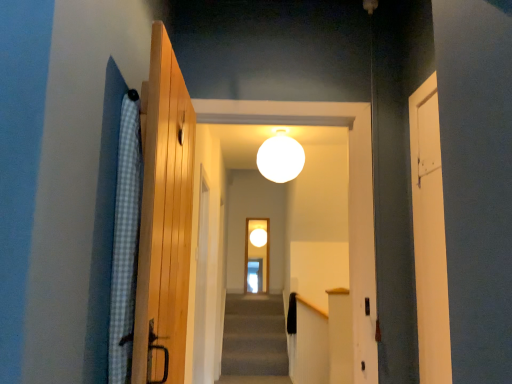
Question: Is wooden door at center, which ranks as the 1th door in back-to-front order, at the right side of blue checkered fabric at left?

Choices:
 (A) no
 (B) yes

Answer: (A)

Question: Is wooden door at center, which ranks as the 1th door in back-to-front order, positioned far away from blue checkered fabric at left?

Choices:
 (A) no
 (B) yes

Answer: (B)

Question: From a real-world perspective, is wooden door at center, which is the first door in left-to-right order, physically below blue checkered fabric at left?

Choices:
 (A) no
 (B) yes

Answer: (B)

Question: Would you say wooden door at center, which ranks as the 1th door in back-to-front order, is outside blue checkered fabric at left?

Choices:
 (A) yes
 (B) no

Answer: (A)

Question: Can you confirm if wooden door at center, which appears as the 3th door when viewed from the front, is shorter than blue checkered fabric at left?

Choices:
 (A) no
 (B) yes

Answer: (A)

Question: Does wooden door at center, which appears as the 3th door when viewed from the front, have a greater height compared to blue checkered fabric at left?

Choices:
 (A) no
 (B) yes

Answer: (B)

Question: From a real-world perspective, is white matte sphere at center positioned under blue checkered fabric at left based on gravity?

Choices:
 (A) no
 (B) yes

Answer: (A)

Question: Is white matte sphere at center at the left side of blue checkered fabric at left?

Choices:
 (A) no
 (B) yes

Answer: (A)

Question: From the image's perspective, is white matte sphere at center located above blue checkered fabric at left?

Choices:
 (A) no
 (B) yes

Answer: (B)

Question: Is white matte sphere at center placed right next to blue checkered fabric at left?

Choices:
 (A) no
 (B) yes

Answer: (A)

Question: From a real-world perspective, is white matte sphere at center positioned over blue checkered fabric at left based on gravity?

Choices:
 (A) no
 (B) yes

Answer: (B)

Question: Is white matte sphere at center smaller than blue checkered fabric at left?

Choices:
 (A) yes
 (B) no

Answer: (B)

Question: Could white matte door at right, the 3th door in the left-to-right sequence, be considered to be inside blue checkered fabric at left?

Choices:
 (A) no
 (B) yes

Answer: (A)